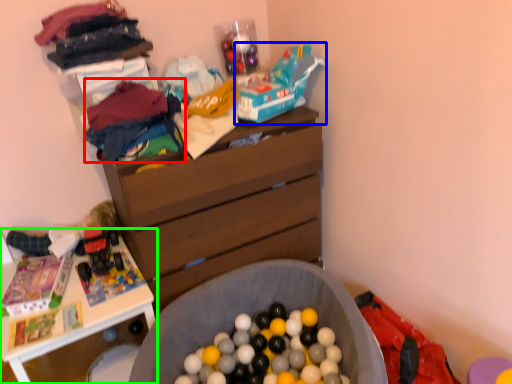
Question: Considering the real-world distances, which object is farthest from clothing (highlighted by a red box)? toy car (highlighted by a blue box) or table (highlighted by a green box)?

Choices:
 (A) toy car
 (B) table

Answer: (B)